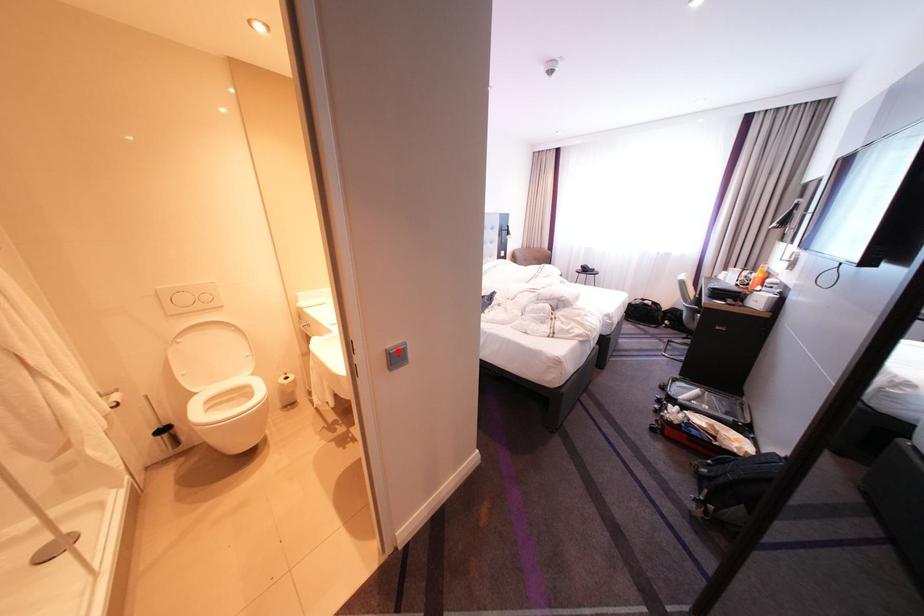
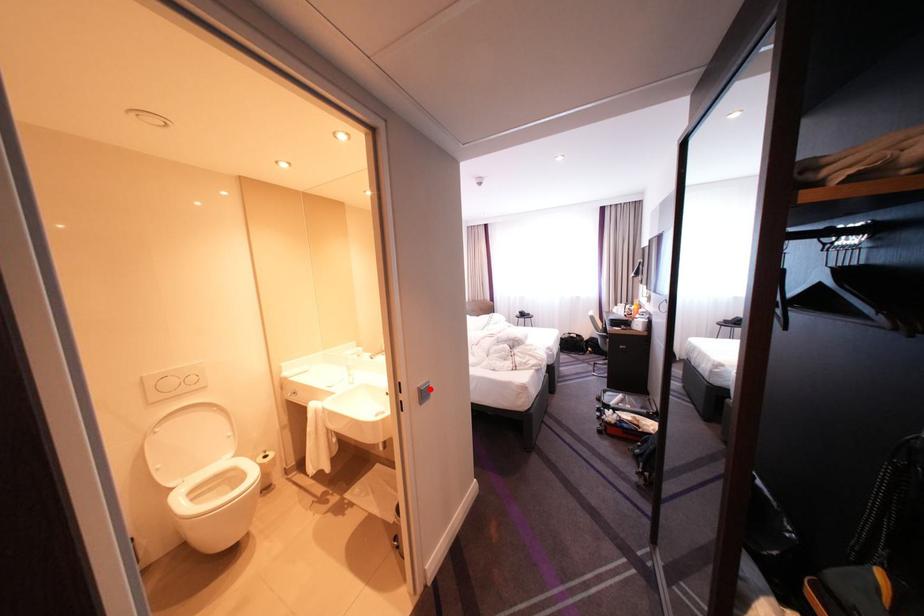
I am providing you with two images of the same scene from different viewpoints. A red point is marked on the first image and another point is marked on the second image. Is the red point in image1 aligned with the point shown in image2?

Yes